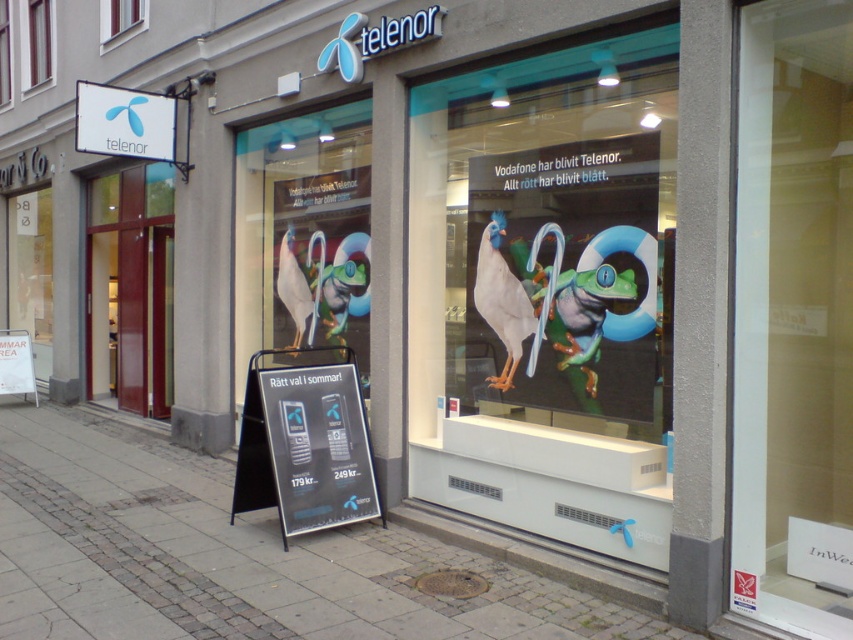
What is the spatial relationship between the matte glass window at center and the clear glass window at upper left in the Telenor store storefront?

The matte glass window at center is in front of the clear glass window at upper left, meaning the clear glass window at upper left is positioned behind it.

In the scene shown: You are a delivery person arriving at the Telenor store. You need to place a package on the surface that is larger between the matte glass window at center and the wooden frame at upper left. Which surface should you choose?

The matte glass window at center has a larger size compared to wooden frame at upper left, so you should place the package on the matte glass window at center.